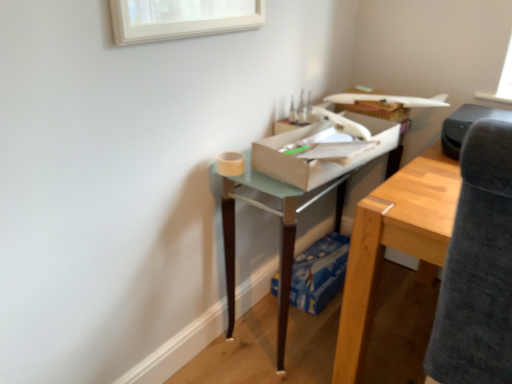
Where is `free space above blue cardboard box at lower center, which ranks as the 2th cardboard box in front-to-back order (from a real-world perspective)`? This screenshot has height=384, width=512. free space above blue cardboard box at lower center, which ranks as the 2th cardboard box in front-to-back order (from a real-world perspective) is located at coordinates (324, 259).